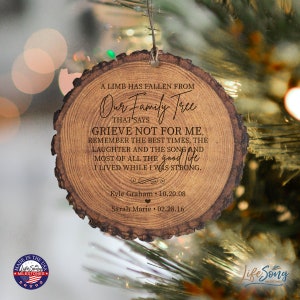
Where is `pendant`? The height and width of the screenshot is (300, 300). pendant is located at coordinates (139, 157).